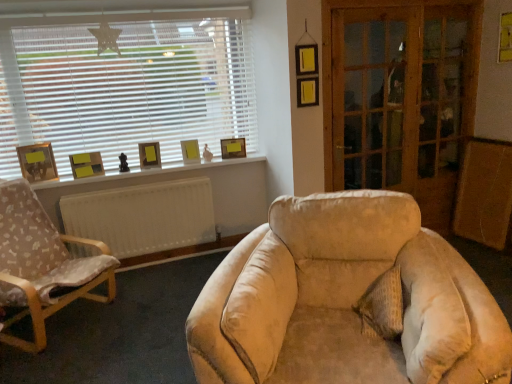
Identify the location of blank space situated above wooden glass screen door at right, which is counted as the second screen door, starting from the right (from a real-world perspective). (385, 5).